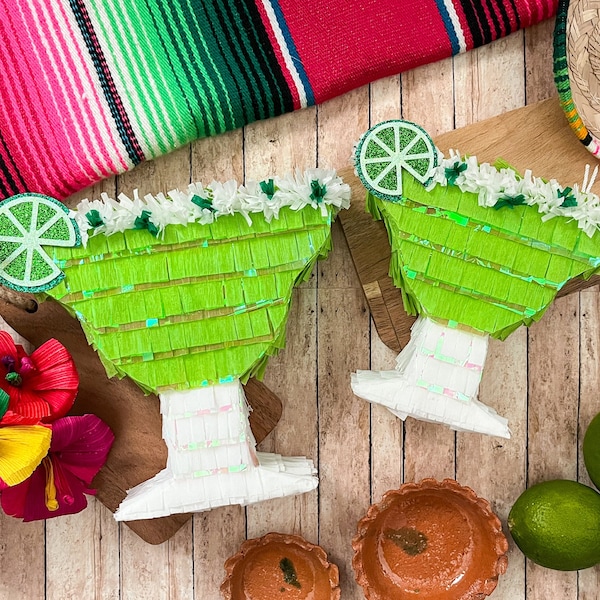
Image resolution: width=600 pixels, height=600 pixels. Identify the location of fabric flowers. (56, 473), (22, 379).